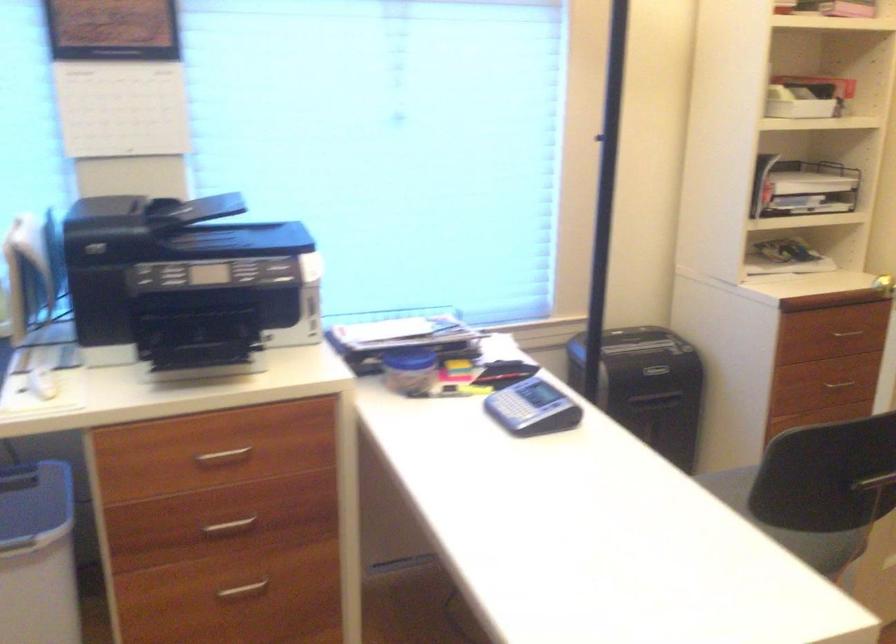
This screenshot has height=644, width=896. What do you see at coordinates (409, 359) in the screenshot? I see `a blue jar lid` at bounding box center [409, 359].